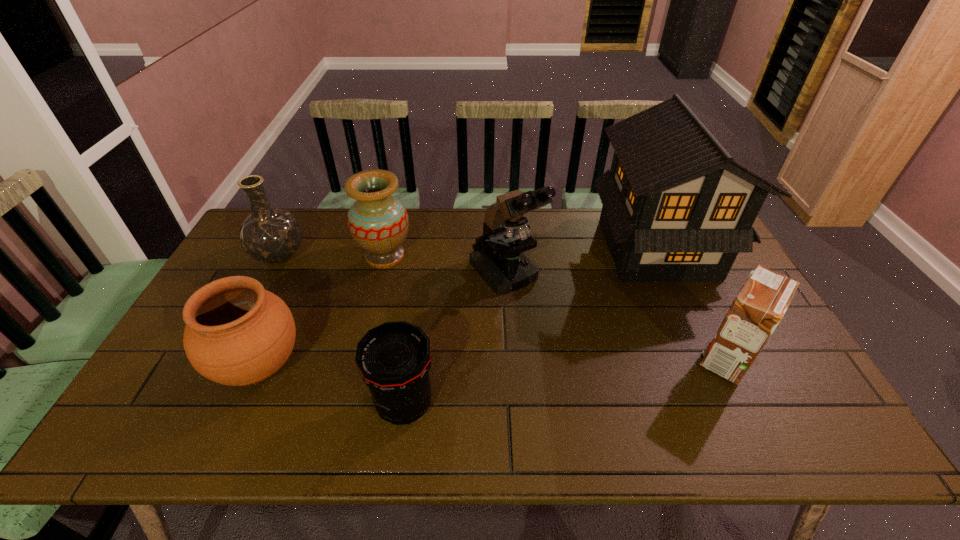
Find the location of a particular element. the tallest object is located at coordinates (682, 194).

Where is `the third object from right to left`? This screenshot has width=960, height=540. the third object from right to left is located at coordinates (501, 263).

The width and height of the screenshot is (960, 540). I want to click on the sixth shortest object, so (x=501, y=263).

Locate an element on the screen. the left vase is located at coordinates (270, 235).

Where is `the right vase`? the right vase is located at coordinates (378, 222).

Where is `carton`? This screenshot has height=540, width=960. carton is located at coordinates (761, 303).

The image size is (960, 540). Identify the location of pottery. (237, 333).

Locate an element on the screen. This screenshot has height=540, width=960. telephoto lens is located at coordinates (394, 359).

You are a GUI agent. You are given a task and a screenshot of the screen. Output one action in this format:
    pyautogui.click(x=<x>, y=<y>)
    Task: Click on the vacant space located on the front-facing side of the dollhouse
    
    Given the screenshot: What is the action you would take?
    pyautogui.click(x=580, y=248)

In order to click on free space located on the front-facing side of the dollhouse in this screenshot , I will do `click(502, 248)`.